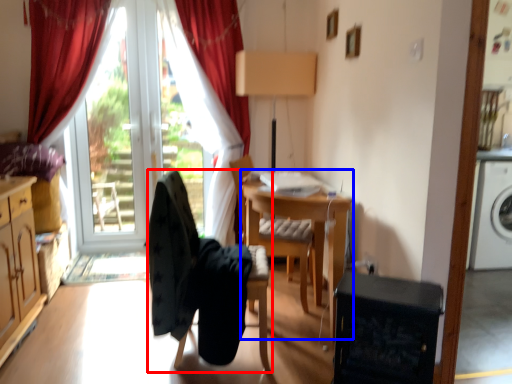
Question: Which of the following is the closest to the observer, chair (highlighted by a red box) or computer desk (highlighted by a blue box)?

Choices:
 (A) chair
 (B) computer desk

Answer: (A)